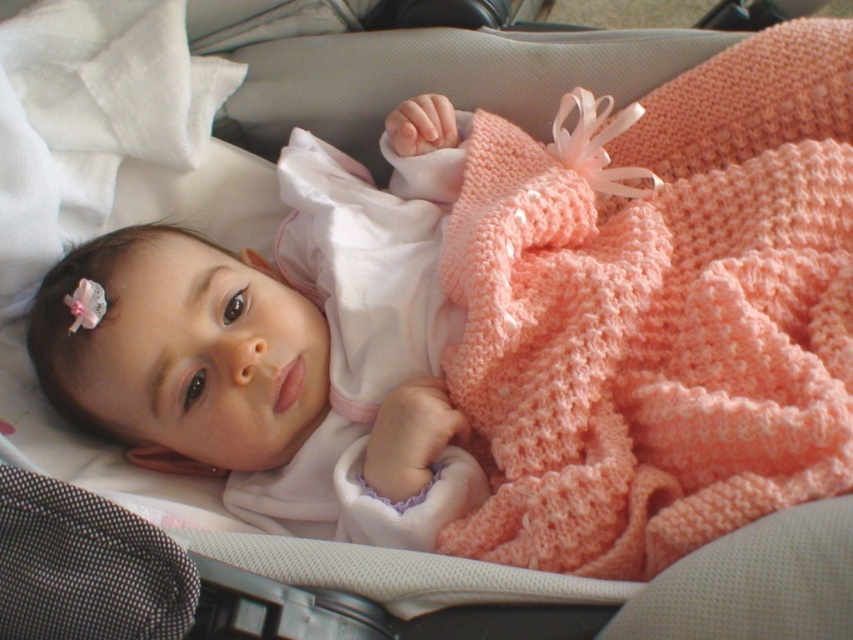
You are a photographer taking a picture of the baby. The peach knitted blanket at center and the matte white baby at center are both in the frame. Which object is closer to the camera?

The peach knitted blanket at center is in front of the matte white baby at center, so it is closer to the camera.

You are a photographer taking a picture of the baby. To ensure the matte white baby at center is centered in the frame, should you move the peach knitted blanket at center to the left or right?

The peach knitted blanket at center is currently to the right of the matte white baby at center. To center the matte white baby at center, you should move the peach knitted blanket at center to the right, allowing the baby to shift left into the center position.

You are a photographer adjusting your camera to focus on two points in the image of the baby. The first point is point (544, 406) and the second is point (158, 250). Which point should you focus on first if you want to capture the closest object to the camera?

Point (544, 406) is closer to the camera than point (158, 250), so you should focus on point (544, 406) first to capture the closest object.